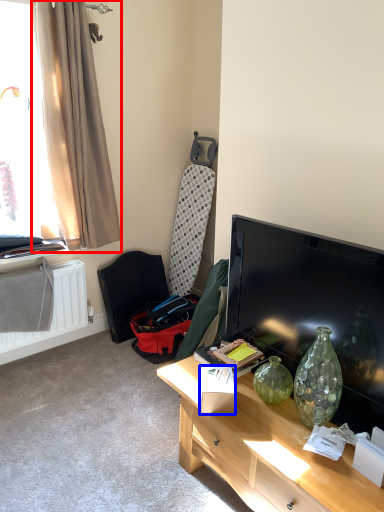
Question: Among these objects, which one is farthest to the camera, curtain (highlighted by a red box) or box (highlighted by a blue box)?

Choices:
 (A) curtain
 (B) box

Answer: (A)